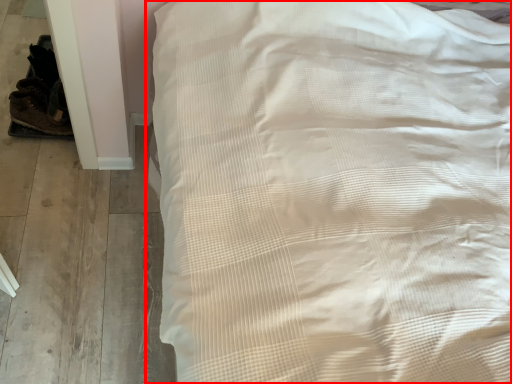
Question: From the image's perspective, what is the correct spatial relationship of bed (annotated by the red box) in relation to shoe?

Choices:
 (A) below
 (B) above

Answer: (A)